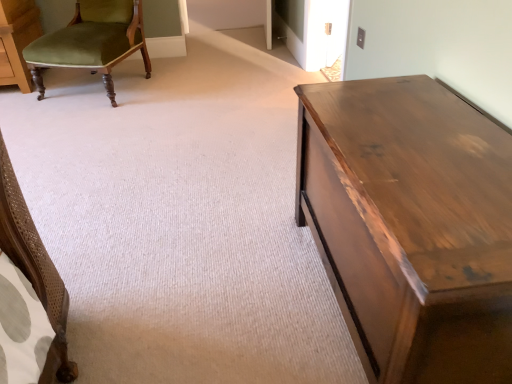
Measure the distance between shiny brown wood table at right and camera.

The depth of shiny brown wood table at right is 24.84 inches.

What is the approximate width of shiny brown wood table at right?

shiny brown wood table at right is 46.70 centimeters in width.

Identify the location of shiny brown wood table at right. (411, 225).

The image size is (512, 384). What do you see at coordinates (411, 225) in the screenshot?
I see `shiny brown wood table at right` at bounding box center [411, 225].

What do you see at coordinates (92, 41) in the screenshot? I see `green velvet chair at upper left` at bounding box center [92, 41].

Identify the location of green velvet chair at upper left. (92, 41).

In order to face green velvet chair at upper left, should I rotate leftwards or rightwards?

You should look left and rotate roughly 20.824 degrees.

Image resolution: width=512 pixels, height=384 pixels. Find the location of `shiny brown wood table at right`. shiny brown wood table at right is located at coordinates (411, 225).

Considering the positions of objects shiny brown wood table at right and green velvet chair at upper left in the image provided, who is more to the right, shiny brown wood table at right or green velvet chair at upper left?

Positioned to the right is shiny brown wood table at right.

Which is in front, shiny brown wood table at right or green velvet chair at upper left?

shiny brown wood table at right is more forward.

Considering the points (323, 210) and (33, 57), which point is behind, point (323, 210) or point (33, 57)?

Point (33, 57)

From the image's perspective, is shiny brown wood table at right below green velvet chair at upper left?

Yes.

From the picture: From a real-world perspective, which object stands above the other?

From a 3D spatial view, green velvet chair at upper left is above.

Which object is wider, shiny brown wood table at right or green velvet chair at upper left?

green velvet chair at upper left.

Between shiny brown wood table at right and green velvet chair at upper left, which one has more height?

green velvet chair at upper left is taller.

Considering the relative sizes of shiny brown wood table at right and green velvet chair at upper left in the image provided, is shiny brown wood table at right bigger than green velvet chair at upper left?

Incorrect, shiny brown wood table at right is not larger than green velvet chair at upper left.

Is green velvet chair at upper left located within shiny brown wood table at right?

No.

Are shiny brown wood table at right and green velvet chair at upper left far apart?

Yes, shiny brown wood table at right is far from green velvet chair at upper left.

Could you tell me if shiny brown wood table at right is facing green velvet chair at upper left?

No, shiny brown wood table at right does not turn towards green velvet chair at upper left.

How many degrees apart are the facing directions of shiny brown wood table at right and green velvet chair at upper left?

shiny brown wood table at right and green velvet chair at upper left are facing 64.8 degrees away from each other.

How much distance is there between shiny brown wood table at right and green velvet chair at upper left?

shiny brown wood table at right and green velvet chair at upper left are 1.97 meters apart from each other.

You are a GUI agent. You are given a task and a screenshot of the screen. Output one action in this format:
    pyautogui.click(x=<x>, y=<y>)
    Task: Click on the chair above the shiny brown wood table at right (from a real-world perspective)
    The width and height of the screenshot is (512, 384).
    Given the screenshot: What is the action you would take?
    pyautogui.click(x=92, y=41)

Considering the positions of objects green velvet chair at upper left and shiny brown wood table at right in the image provided, who is more to the left, green velvet chair at upper left or shiny brown wood table at right?

green velvet chair at upper left.

Considering the relative positions of green velvet chair at upper left and shiny brown wood table at right in the image provided, is green velvet chair at upper left behind shiny brown wood table at right?

Yes, it is.

Which point is more distant from viewer, (104, 70) or (300, 215)?

Point (104, 70)

From the image's perspective, would you say green velvet chair at upper left is positioned over shiny brown wood table at right?

Yes, from the image's perspective, green velvet chair at upper left is above shiny brown wood table at right.

From a real-world perspective, which object stands above the other?

From a 3D spatial view, green velvet chair at upper left is above.

Does green velvet chair at upper left have a lesser width compared to shiny brown wood table at right?

In fact, green velvet chair at upper left might be wider than shiny brown wood table at right.

Which of these two, green velvet chair at upper left or shiny brown wood table at right, stands taller?

Standing taller between the two is green velvet chair at upper left.

Looking at this image, can you confirm if green velvet chair at upper left is bigger than shiny brown wood table at right?

Correct, green velvet chair at upper left is larger in size than shiny brown wood table at right.

Can we say green velvet chair at upper left lies outside shiny brown wood table at right?

Yes, green velvet chair at upper left is outside of shiny brown wood table at right.

Is green velvet chair at upper left placed right next to shiny brown wood table at right?

No, green velvet chair at upper left is not next to shiny brown wood table at right.

Could you tell me if green velvet chair at upper left is facing shiny brown wood table at right?

No.

What's the angular difference between green velvet chair at upper left and shiny brown wood table at right's facing directions?

64.8 degrees.

How far apart are green velvet chair at upper left and shiny brown wood table at right?

green velvet chair at upper left and shiny brown wood table at right are 6.46 feet apart.

This screenshot has width=512, height=384. In order to click on chair that appears behind the shiny brown wood table at right in this screenshot , I will do `click(92, 41)`.

Locate an element on the screen. The image size is (512, 384). chair above the shiny brown wood table at right (from the image's perspective) is located at coordinates (x=92, y=41).

In order to click on chair behind the shiny brown wood table at right in this screenshot , I will do `click(92, 41)`.